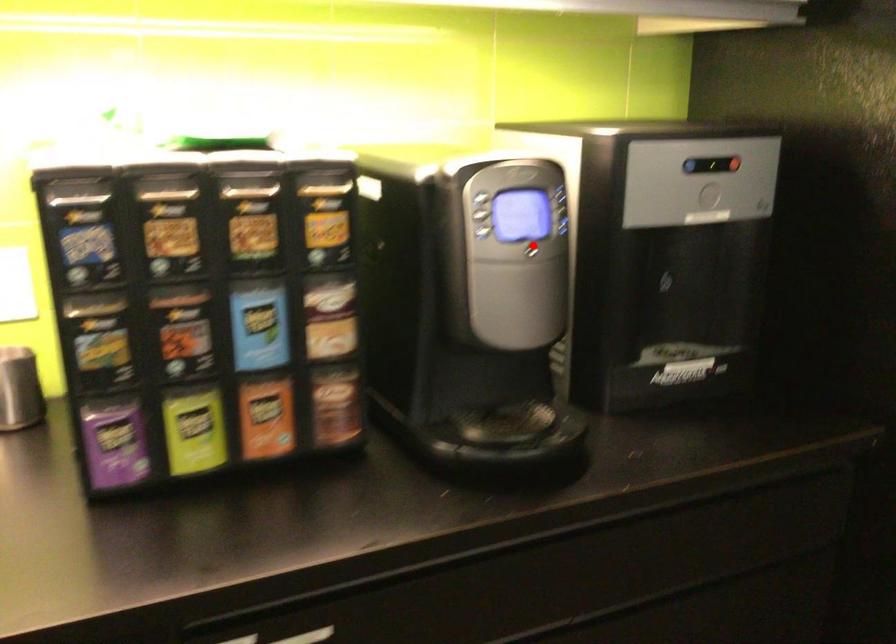
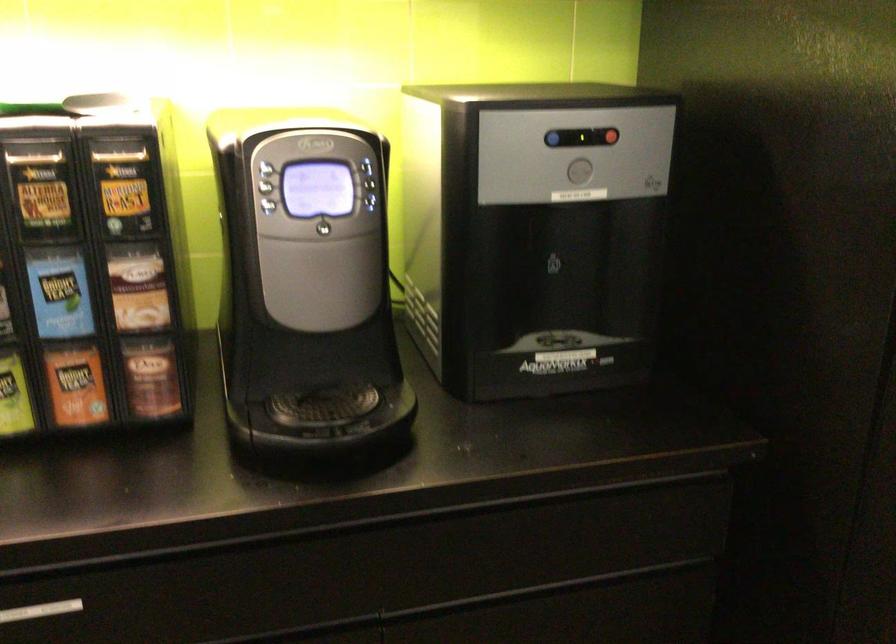
In the second image, find the point that corresponds to the highlighted location in the first image.

(323, 222)